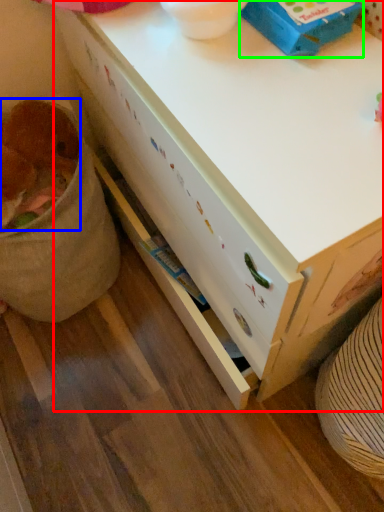
Question: Estimate the real-world distances between objects in this image. Which object is farther from desk (highlighted by a red box), animal (highlighted by a blue box) or box (highlighted by a green box)?

Choices:
 (A) animal
 (B) box

Answer: (A)